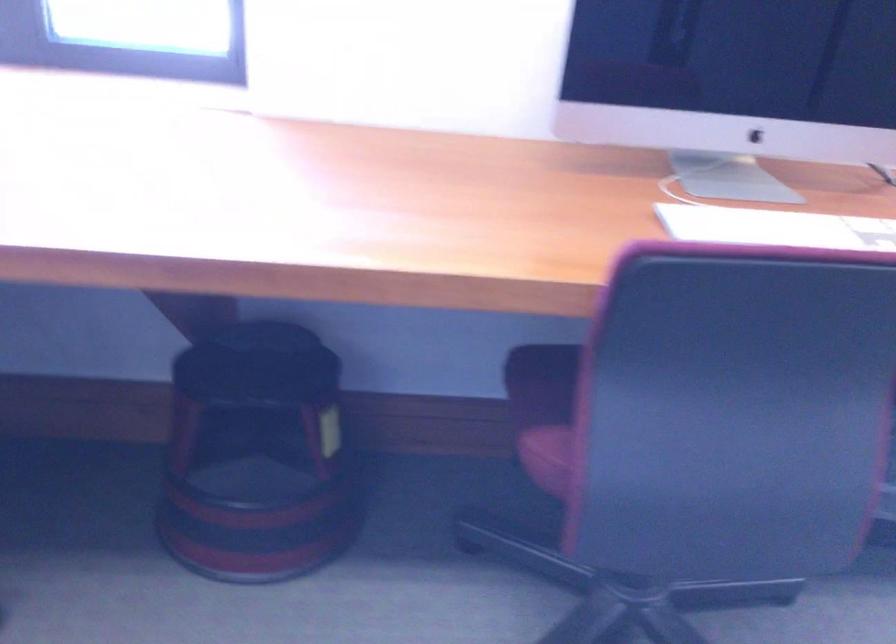
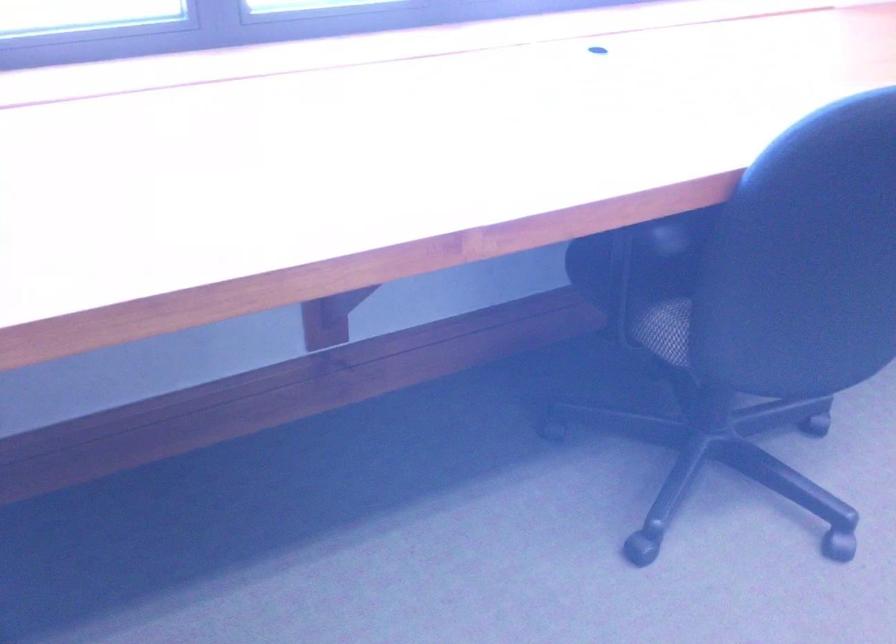
Question: The images are taken continuously from a first-person perspective. In which direction are you moving?

Choices:
 (A) Left
 (B) Right
 (C) Forward
 (D) Backward

Answer: (A)